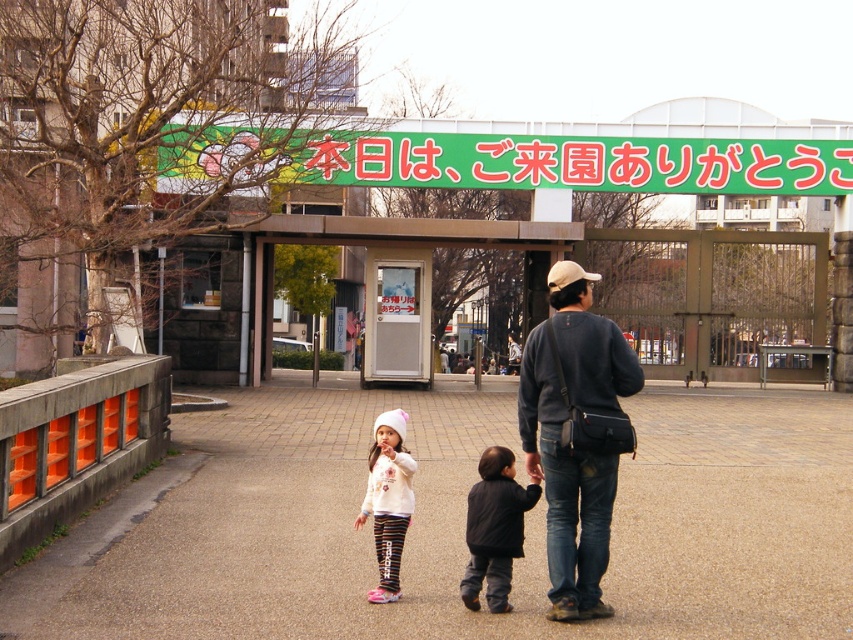
You are standing at the entrance of the park and want to locate the dark gray sweater at center. Based on the coordinates provided in the description, can you determine its position relative to the camera?

The dark gray sweater at center is located at point coordinates [575,435], which places it in the lower right quadrant of the image from the camera perspective.

You are a photographer trying to capture a candid shot of the two people at the center of the image. The camera you are using has a limited focus range. If you focus on the dark gray sweater at center, will the black soft jacket at center also be in focus? Please explain your reasoning based on their positions.

The dark gray sweater at center might be wider than black soft jacket at center, so there is a possibility that the black soft jacket at center could be within the focus range if the depth of field is sufficient. However, without knowing the exact distance between them, it is uncertain. The photographer should ensure the depth of field covers both subjects or adjust focus accordingly.